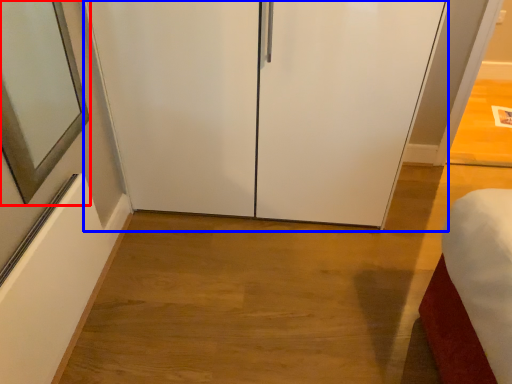
Question: Among these objects, which one is farthest to the camera, mirror (highlighted by a red box) or glass door (highlighted by a blue box)?

Choices:
 (A) mirror
 (B) glass door

Answer: (B)